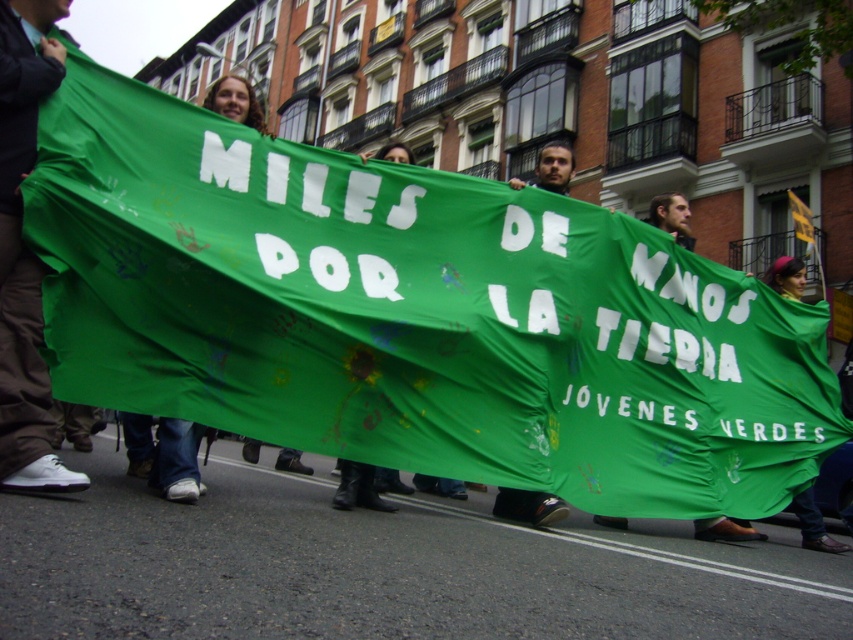
Question: In this image, where is white matte shoe at lower left located relative to green fabric banner at center?

Choices:
 (A) below
 (B) above

Answer: (A)

Question: Is white matte shoe at lower left positioned at the back of green fabric banner at center?

Choices:
 (A) no
 (B) yes

Answer: (A)

Question: Does white matte shoe at lower left have a smaller size compared to green fabric banner at center?

Choices:
 (A) yes
 (B) no

Answer: (A)